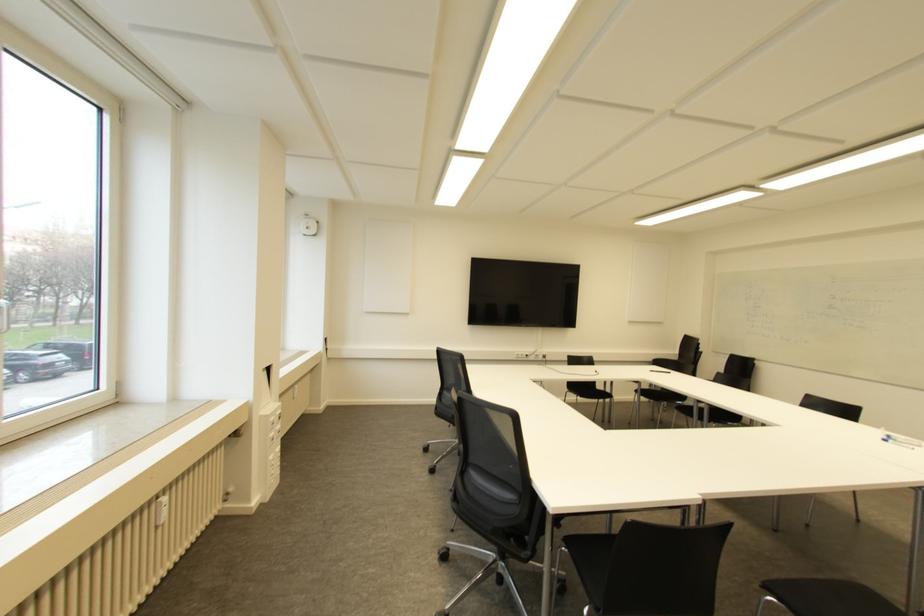
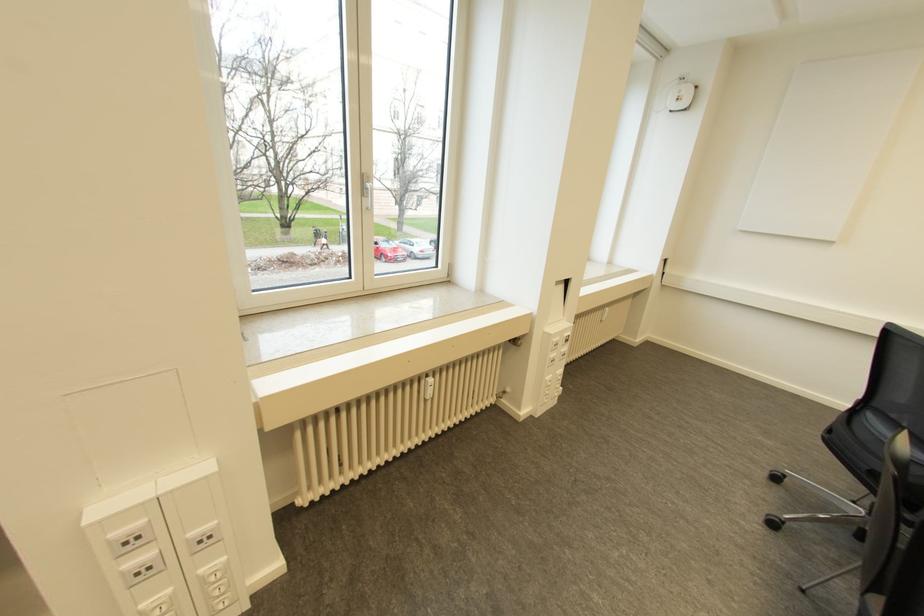
Locate, in the second image, the point that corresponds to [163,499] in the first image.

(430, 379)